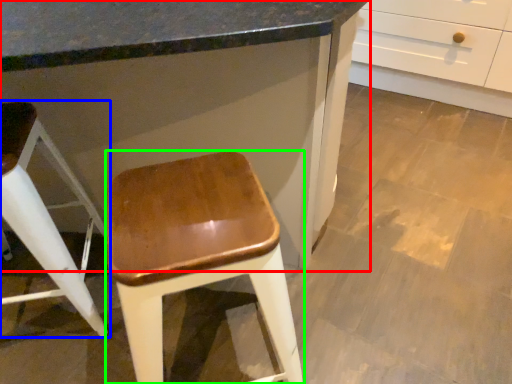
Question: Which object is the farthest from cabinetry (highlighted by a red box)? Choose among these: stool (highlighted by a blue box) or stool (highlighted by a green box).

Choices:
 (A) stool
 (B) stool

Answer: (A)